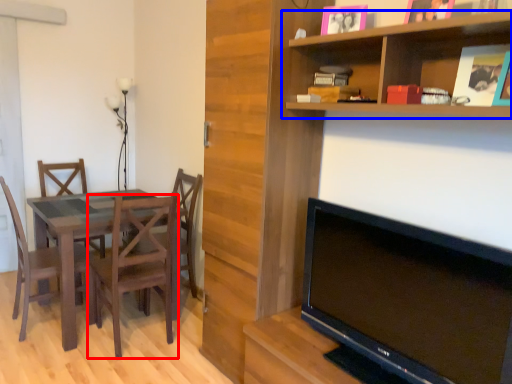
Question: Which object is closer to the camera taking this photo, chair (highlighted by a red box) or shelf (highlighted by a blue box)?

Choices:
 (A) chair
 (B) shelf

Answer: (B)